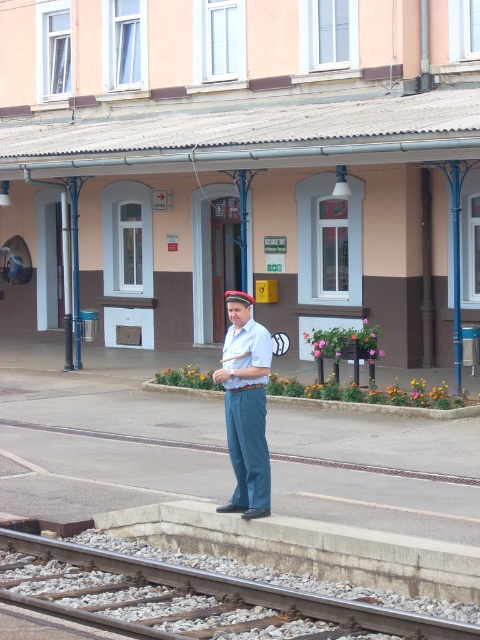
Question: Is beige concrete platform at center smaller than smooth metal rail at lower center?

Choices:
 (A) no
 (B) yes

Answer: (A)

Question: Can you confirm if beige concrete platform at center is positioned below smooth metal rail at lower center?

Choices:
 (A) yes
 (B) no

Answer: (B)

Question: Which point appears farthest from the camera in this image?

Choices:
 (A) (257, 401)
 (B) (239, 580)
 (C) (297, 88)

Answer: (C)

Question: Which point is closer to the camera?

Choices:
 (A) beige concrete platform at center
 (B) blue cotton pants at center
 (C) smooth metal rail at lower center

Answer: (C)

Question: Based on their relative distances, which object is farther from the blue cotton pants at center?

Choices:
 (A) smooth metal rail at lower center
 (B) beige concrete platform at center

Answer: (B)

Question: Can you confirm if beige concrete platform at center is positioned above blue cotton pants at center?

Choices:
 (A) yes
 (B) no

Answer: (A)